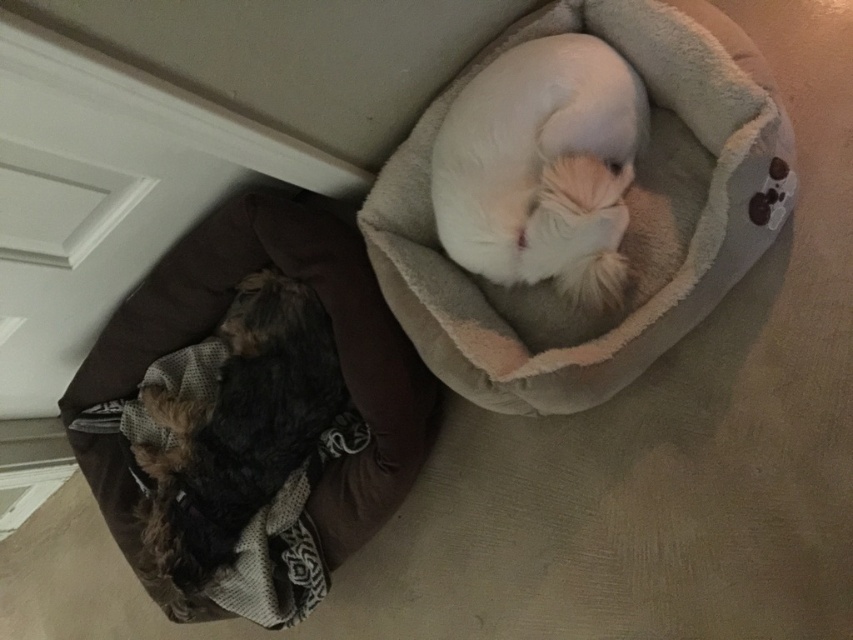
You are standing in a room with two dogs. You need to place a small toy exactly at the point that is 1.60 meters away from you. The point is located at coordinates point [334,291]. Which dog bed should you aim the toy towards to ensure it lands at that specific point?

The point [334,291] is 1.60 meters away from the viewer, so you should aim the toy towards the dog bed at that point to ensure it lands there.

Based on the photo, you are standing in the room with two dogs resting on their beds. You need to pick up an object that is closer to you. Which point should you choose, point (389, 506) or point (595, 93)?

Point (595, 93) is closer to you than point (389, 506), so you should choose point (595, 93).